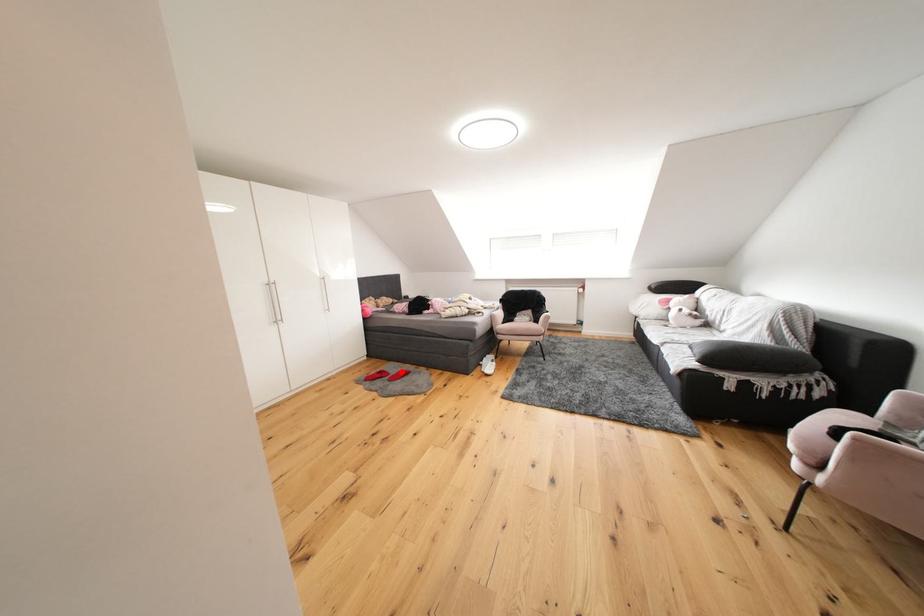
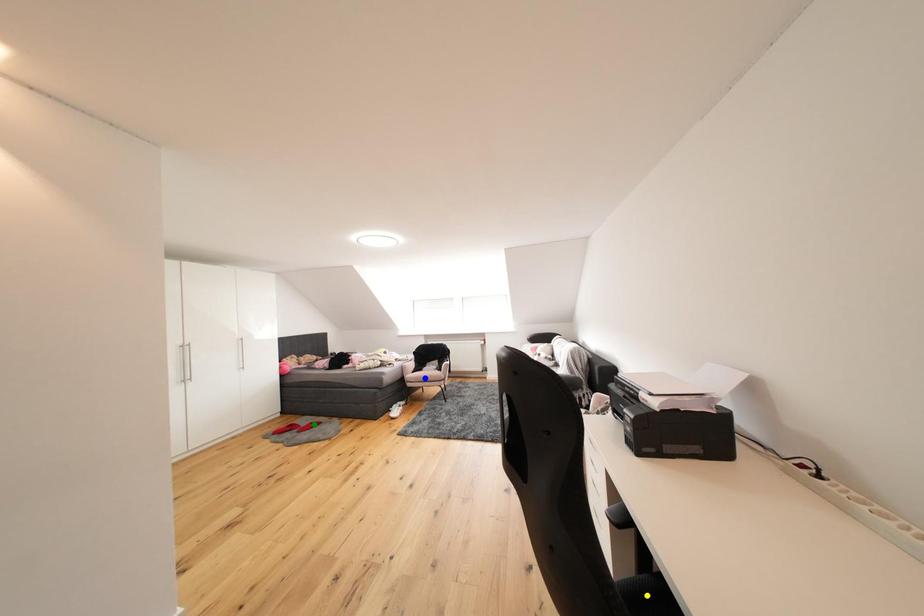
Question: I am providing you with two images of the same scene from different viewpoints. A red point is marked on the first image. You are given multiple points on the second image. Can you choose the point in image 2 that corresponds to the point in image 1?

Choices:
 (A) green point
 (B) blue point
 (C) yellow point

Answer: (A)